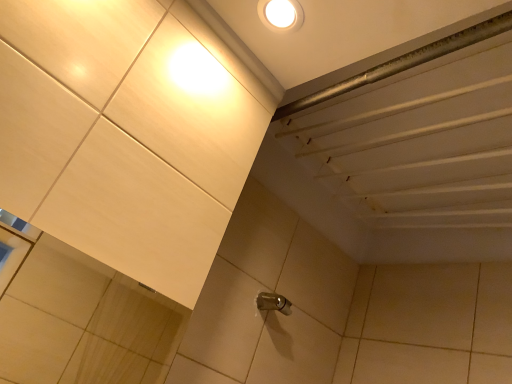
Question: From the image's perspective, does satin nickel faucet at center appear lower than white glossy droplight at upper center?

Choices:
 (A) yes
 (B) no

Answer: (A)

Question: From a real-world perspective, is satin nickel faucet at center over white glossy droplight at upper center?

Choices:
 (A) no
 (B) yes

Answer: (A)

Question: Would you say satin nickel faucet at center is a long distance from white glossy droplight at upper center?

Choices:
 (A) yes
 (B) no

Answer: (B)

Question: Could you tell me if satin nickel faucet at center is facing white glossy droplight at upper center?

Choices:
 (A) no
 (B) yes

Answer: (A)

Question: From a real-world perspective, is satin nickel faucet at center located beneath white glossy droplight at upper center?

Choices:
 (A) no
 (B) yes

Answer: (B)

Question: Is satin nickel faucet at center in front of white glossy droplight at upper center?

Choices:
 (A) yes
 (B) no

Answer: (B)

Question: Does white glossy droplight at upper center come in front of satin nickel faucet at center?

Choices:
 (A) no
 (B) yes

Answer: (B)

Question: Can you confirm if white glossy droplight at upper center is smaller than satin nickel faucet at center?

Choices:
 (A) yes
 (B) no

Answer: (A)

Question: Would you consider white glossy droplight at upper center to be distant from satin nickel faucet at center?

Choices:
 (A) yes
 (B) no

Answer: (B)

Question: Considering the relative sizes of white glossy droplight at upper center and satin nickel faucet at center in the image provided, is white glossy droplight at upper center bigger than satin nickel faucet at center?

Choices:
 (A) yes
 (B) no

Answer: (B)

Question: Is white glossy droplight at upper center outside satin nickel faucet at center?

Choices:
 (A) no
 (B) yes

Answer: (B)

Question: Does white glossy droplight at upper center have a greater height compared to satin nickel faucet at center?

Choices:
 (A) yes
 (B) no

Answer: (B)

Question: From the image's perspective, relative to satin nickel faucet at center, is white glossy droplight at upper center above or below?

Choices:
 (A) below
 (B) above

Answer: (B)